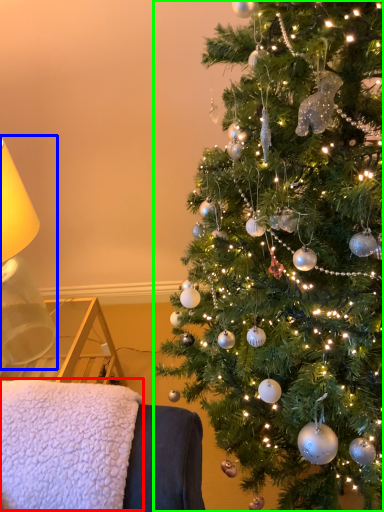
Question: Which object is the closest to the blanket (highlighted by a red box)? Choose among these: table lamp (highlighted by a blue box) or christmas tree (highlighted by a green box).

Choices:
 (A) table lamp
 (B) christmas tree

Answer: (B)